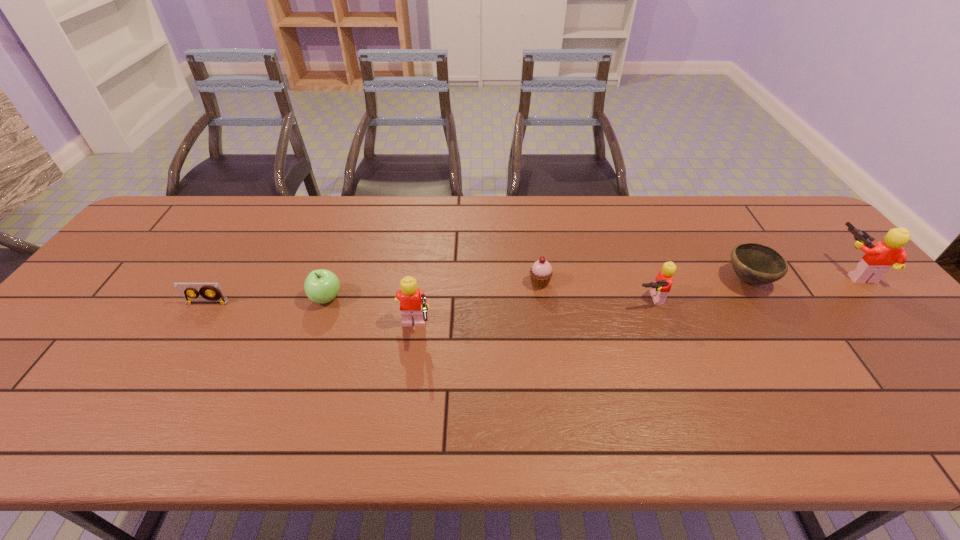
In order to click on free space for a new Lego on the left in this screenshot , I will do `click(144, 366)`.